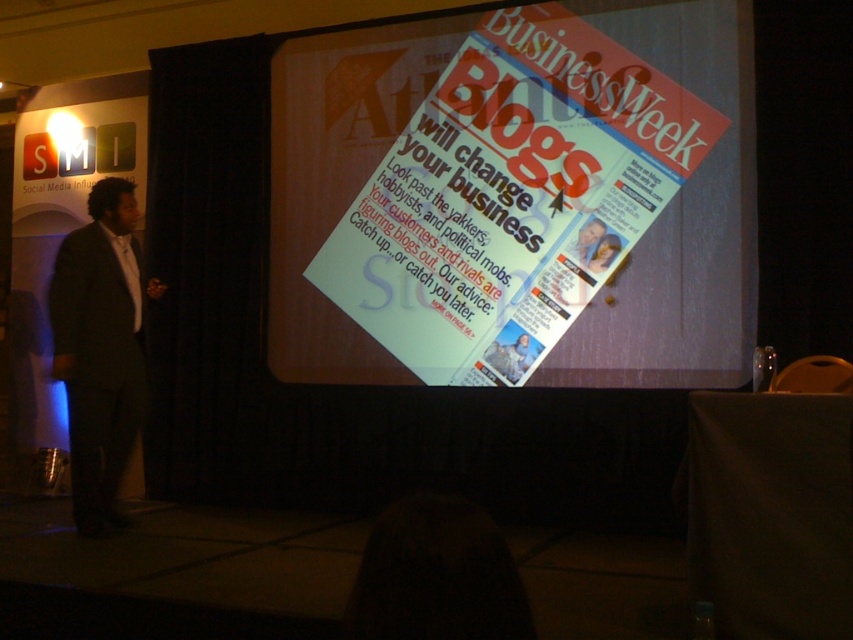
You are a photographer in a presentation room. You need to capture a photo of both the matte paper magazine at center and the dark gray suit at left. Which object should you focus on first to ensure both are in frame?

The matte paper magazine at center is bigger than the dark gray suit at left, so you should focus on the matte paper magazine at center first to ensure both are in frame.

You are a photographer in a presentation room. You need to capture a photo of the matte paper magazine at center and the dark gray suit at left. Which object should you focus on first if you want to ensure both are in sharp focus, considering their sizes?

The matte paper magazine at center has a greater height compared to the dark gray suit at left, so you should focus on the matte paper magazine at center first to ensure both are in sharp focus.